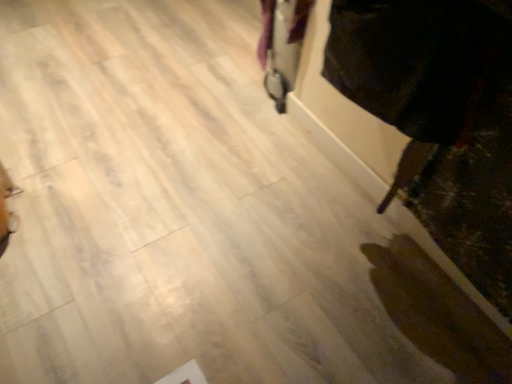
Question: Should I look upward or downward to see dark velvet robe at right?

Choices:
 (A) up
 (B) down

Answer: (A)